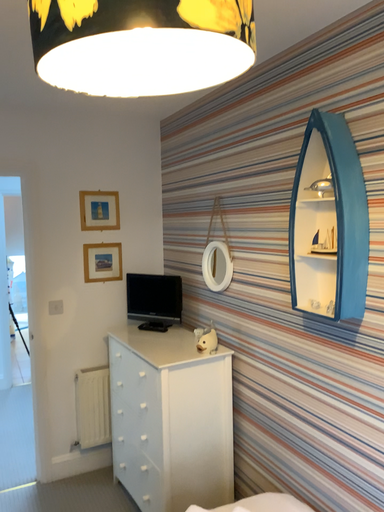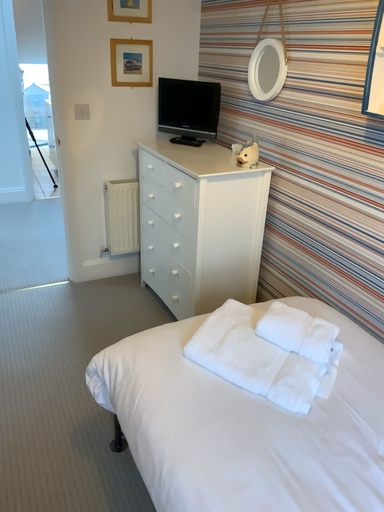
Question: Which way did the camera rotate in the video?

Choices:
 (A) rotated downward
 (B) rotated upward

Answer: (A)